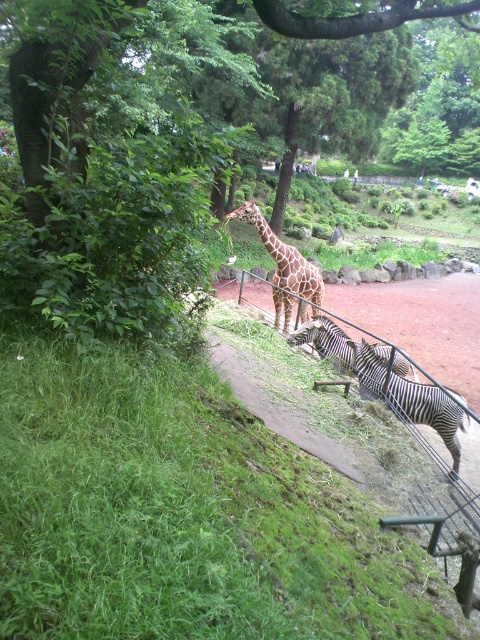
You are a zookeeper standing at the entrance of the enclosure. You need to place a new feeding trough at a specific point to ensure it is accessible to both the giraffe and the zebra. The point is given as point (324, 340). Based on the scene description, can you determine which animal is closer to this point?

The point (324, 340) is occupied by the black and white striped zebra at center, so the zebra is closer to this point than the giraffe.

You are a zookeeper standing at the center of the enclosure. You need to locate the black and white striped zebra at lower right. Which direction should you move to find it?

The black and white striped zebra at lower right is located at point (411, 400), so you should move to the lower right direction to find it.

You are standing in front of the zoo enclosure and want to take a photo of both points mentioned. Which point, point [414,384] or point [335,323], will appear larger in your photo?

Point [414,384] is closer to the camera than point [335,323], so it will appear larger in the photo.